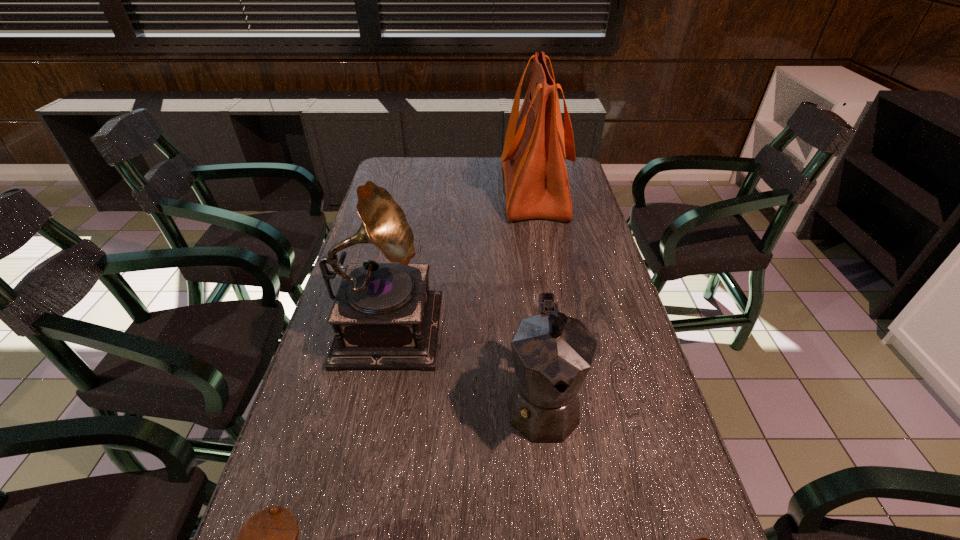
Where is `object that is at the right edge`? The height and width of the screenshot is (540, 960). object that is at the right edge is located at coordinates (536, 145).

You are a GUI agent. You are given a task and a screenshot of the screen. Output one action in this format:
    pyautogui.click(x=<x>, y=<y>)
    Task: Click on the object that is positioned at the far right corner
    The width and height of the screenshot is (960, 540).
    Given the screenshot: What is the action you would take?
    pyautogui.click(x=536, y=145)

The width and height of the screenshot is (960, 540). In order to click on vacant space at the far edge of the desktop in this screenshot , I will do `click(477, 168)`.

This screenshot has width=960, height=540. In the image, there is a desktop. What are the coordinates of `free space at the left edge` in the screenshot? It's located at (335, 454).

I want to click on vacant space at the right edge, so click(x=564, y=230).

In the image, there is a desktop. Identify the location of free region at the far left corner. (393, 160).

I want to click on vacant space at the far right corner, so click(575, 180).

I want to click on vacant area that lies between the record player and the farthest object, so click(x=461, y=256).

Find the location of `empty space between the record player and the coffeepot`. empty space between the record player and the coffeepot is located at coordinates (466, 363).

Locate which object is the second closest to the shopping bag. Please provide its 2D coordinates. Your answer should be formatted as a tuple, i.e. [(x, y)], where the tuple contains the x and y coordinates of a point satisfying the conditions above.

[(553, 353)]